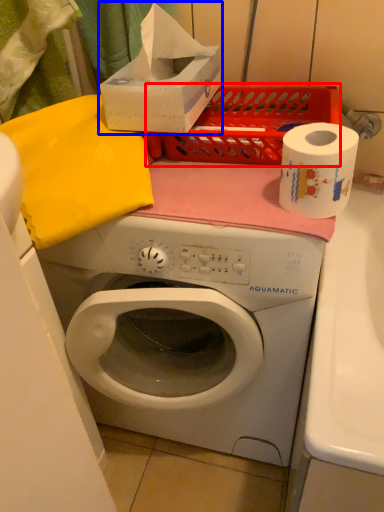
Question: Which object appears farthest to the camera in this image, crate (highlighted by a red box) or box (highlighted by a blue box)?

Choices:
 (A) crate
 (B) box

Answer: (A)